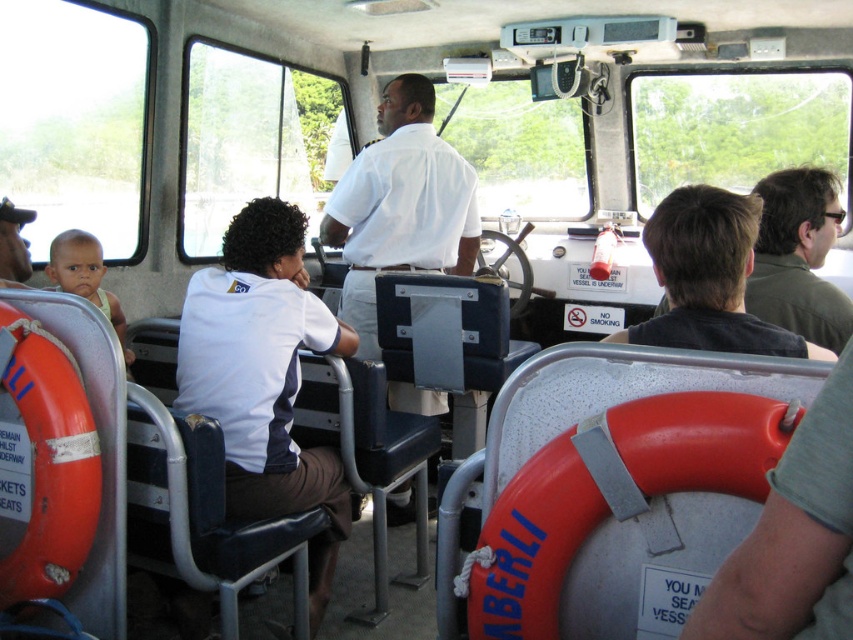
Question: Among these points, which one is nearest to the camera?

Choices:
 (A) (285, 218)
 (B) (755, 458)
 (C) (115, 328)
 (D) (459, 214)

Answer: (B)

Question: Which of the following is the farthest from the observer?

Choices:
 (A) (10, 243)
 (B) (71, 262)
 (C) (241, 477)

Answer: (B)

Question: Is white fabric shirt at center positioned behind matte black shirt at left?

Choices:
 (A) no
 (B) yes

Answer: (A)

Question: Is orange rubber life preserver at lower right smaller than orange rubber life jacket at left?

Choices:
 (A) no
 (B) yes

Answer: (A)

Question: From the image, what is the correct spatial relationship of orange rubber life preserver at lower right in relation to white matte shirt at center?

Choices:
 (A) above
 (B) below

Answer: (B)

Question: Based on their relative distances, which object is nearer to the white matte shirt at center?

Choices:
 (A) light brown skin baby at left
 (B) white fabric shirt at center
 (C) orange rubber life preserver at lower right

Answer: (B)